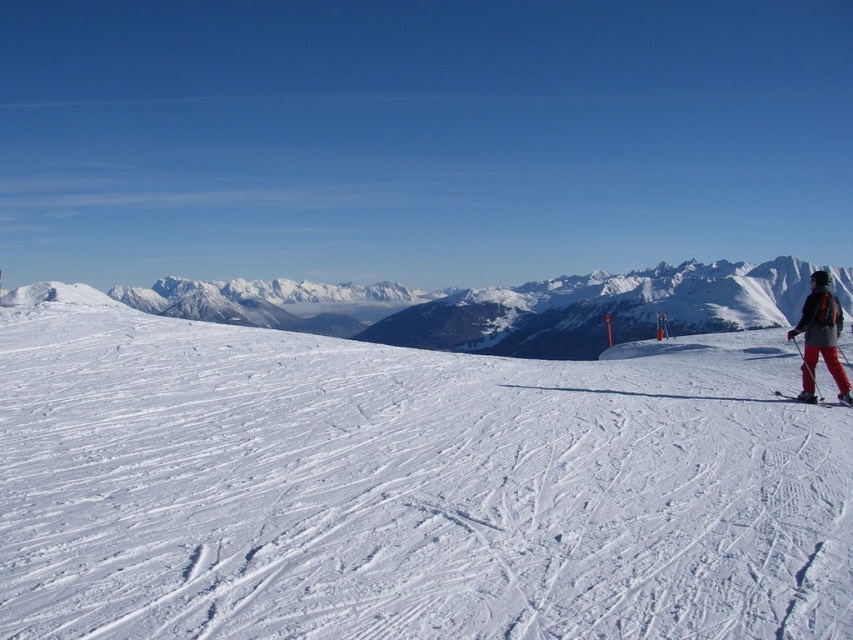
Question: Which of the following is the closest to the observer?

Choices:
 (A) (126, 481)
 (B) (817, 403)

Answer: (A)

Question: Which of the following is the farthest from the observer?

Choices:
 (A) matte red ski at lower right
 (B) red ski pants at right

Answer: (B)

Question: Does white powdery snow at center have a lesser width compared to matte red ski at lower right?

Choices:
 (A) no
 (B) yes

Answer: (A)

Question: Which point is farther to the camera?

Choices:
 (A) red ski pants at right
 (B) matte red ski at lower right

Answer: (A)

Question: From the image, what is the correct spatial relationship of white powdery snow at center in relation to matte red ski at lower right?

Choices:
 (A) below
 (B) above

Answer: (B)

Question: Can you confirm if white powdery snow at center is wider than red ski pants at right?

Choices:
 (A) yes
 (B) no

Answer: (A)